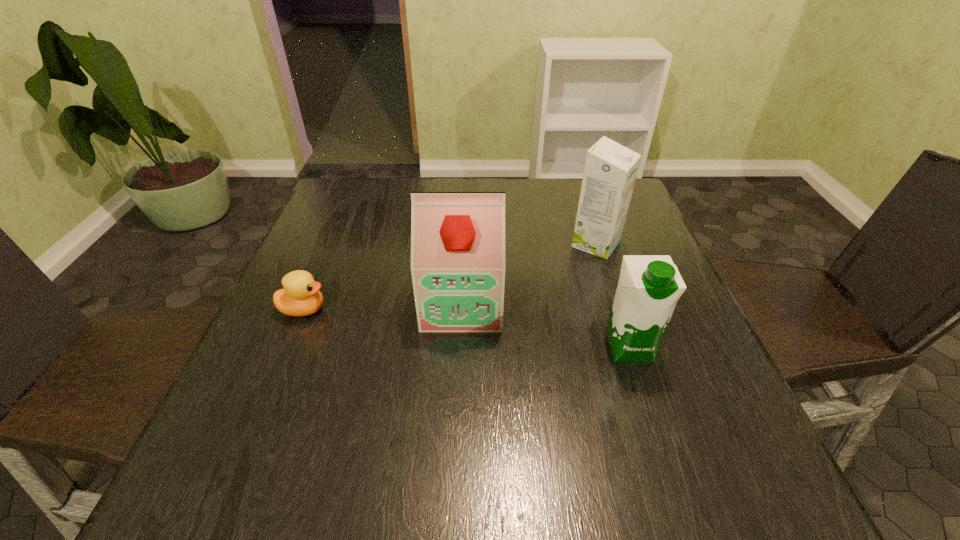
You are a GUI agent. You are given a task and a screenshot of the screen. Output one action in this format:
    pyautogui.click(x=<x>, y=<y>)
    Task: Click on the taller soya milk
    This screenshot has width=960, height=540.
    Given the screenshot: What is the action you would take?
    pyautogui.click(x=457, y=238)

Identify the location of the second object from left to right. click(x=457, y=238).

Where is `the farthest object`? Image resolution: width=960 pixels, height=540 pixels. the farthest object is located at coordinates (610, 171).

This screenshot has height=540, width=960. I want to click on the shorter soya milk, so coord(649,286).

Identify the location of the right soya milk. The width and height of the screenshot is (960, 540). (649, 286).

Find the location of a particular element. The width and height of the screenshot is (960, 540). duckling is located at coordinates (x=300, y=297).

Locate an element on the screen. This screenshot has height=540, width=960. the leftmost object is located at coordinates (300, 297).

Locate an element on the screen. The height and width of the screenshot is (540, 960). vacant space situated 0.300m with the cap open on the taller soya milk is located at coordinates (454, 480).

Locate an element on the screen. vacant region located 0.300m on the left of the carton is located at coordinates (453, 244).

You are a GUI agent. You are given a task and a screenshot of the screen. Output one action in this format:
    pyautogui.click(x=<x>, y=<y>)
    Task: Click on the free space located on the front-facing side of the right soya milk
    This screenshot has height=540, width=960.
    Given the screenshot: What is the action you would take?
    pyautogui.click(x=677, y=492)